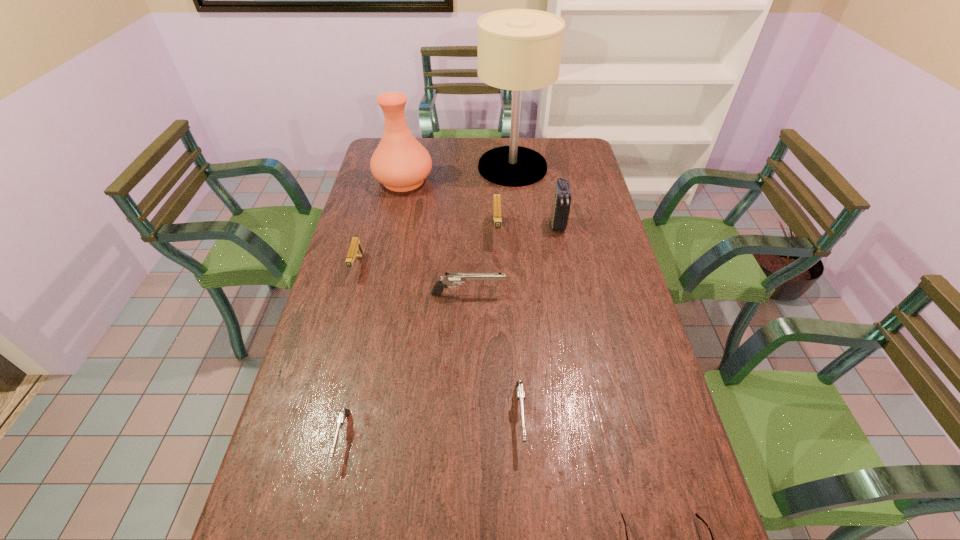
Locate an element on the screen. Image resolution: width=960 pixels, height=540 pixels. free space located 0.090m on the front-facing side of the second shortest pistol is located at coordinates (525, 495).

Image resolution: width=960 pixels, height=540 pixels. In order to click on vacant area situated 0.110m on the front-facing side of the leftmost silver pistol in this screenshot , I will do `click(324, 520)`.

I want to click on table lamp that is at the far edge, so click(518, 49).

Where is `vase that is positioned at the far edge`? The width and height of the screenshot is (960, 540). vase that is positioned at the far edge is located at coordinates (401, 163).

Where is `vase that is at the left edge`? The image size is (960, 540). vase that is at the left edge is located at coordinates (401, 163).

I want to click on object that is at the right edge, so click(560, 210).

The width and height of the screenshot is (960, 540). I want to click on object that is positioned at the far left corner, so click(401, 163).

At what (x,y) coordinates should I click in order to perform the action: click on vacant space at the far edge of the desktop. Please return your answer as a coordinate pair (x, y). The height and width of the screenshot is (540, 960). Looking at the image, I should click on (493, 142).

Where is `vacant space at the left edge of the desktop`? The width and height of the screenshot is (960, 540). vacant space at the left edge of the desktop is located at coordinates 379,193.

The height and width of the screenshot is (540, 960). In the image, there is a desktop. In order to click on vacant space at the right edge in this screenshot , I will do `click(590, 168)`.